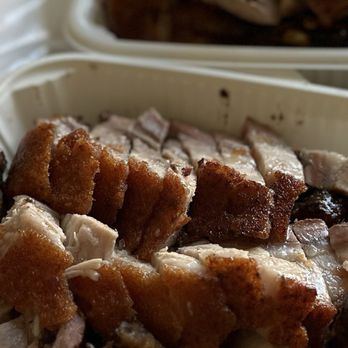
Locate an element on the screen. tray is located at coordinates (112, 87), (92, 29).